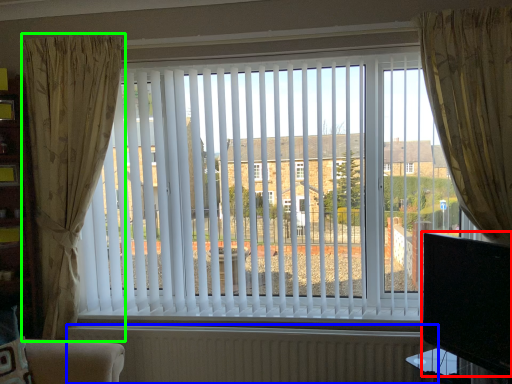
Question: Which object is the farthest from window screen (highlighted by a red box)? Choose among these: radiator (highlighted by a blue box) or curtain (highlighted by a green box).

Choices:
 (A) radiator
 (B) curtain

Answer: (B)